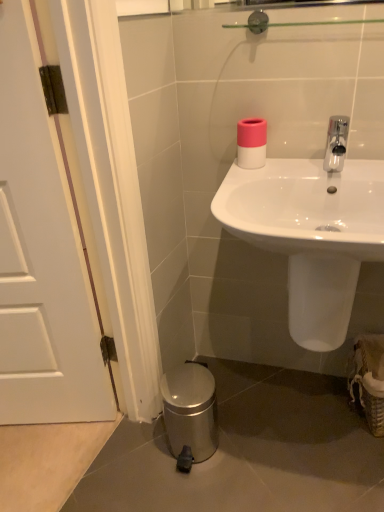
You are a GUI agent. You are given a task and a screenshot of the screen. Output one action in this format:
    pyautogui.click(x=<x>, y=<y>)
    Task: Click on the vacant area that is in front of pink matte toilet paper at upper center
    
    Given the screenshot: What is the action you would take?
    pyautogui.click(x=261, y=173)